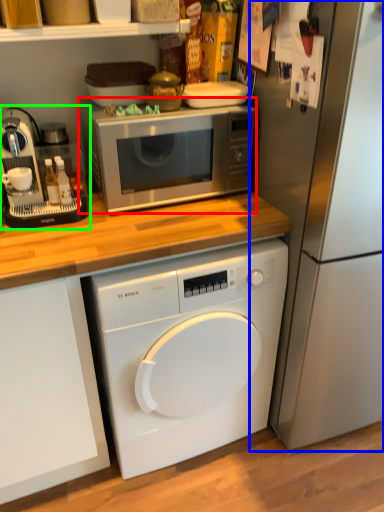
Question: Which is farther away from microwave oven (highlighted by a red box)? refrigerator (highlighted by a blue box) or coffee machine (highlighted by a green box)?

Choices:
 (A) refrigerator
 (B) coffee machine

Answer: (A)